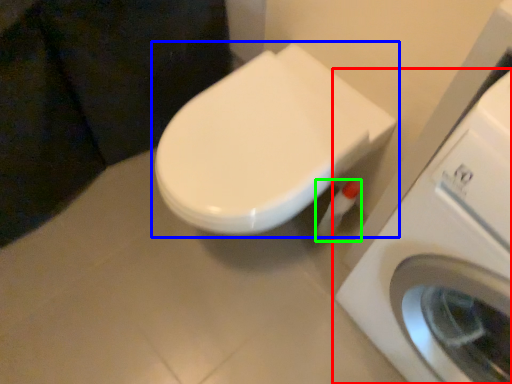
Question: Based on their relative distances, which object is farther from washing machine (highlighted by a red box)? Choose from toilet (highlighted by a blue box) and toilet paper (highlighted by a green box).

Choices:
 (A) toilet
 (B) toilet paper

Answer: (B)